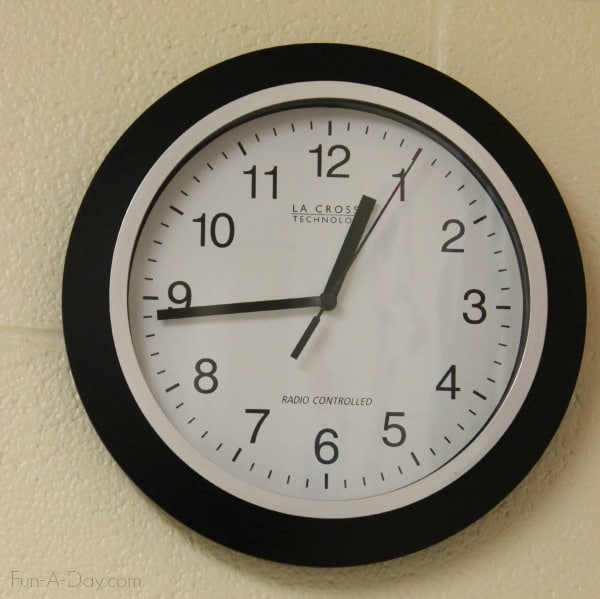
What are the coordinates of `white stripe around clock face` in the screenshot? It's located at (137, 211).